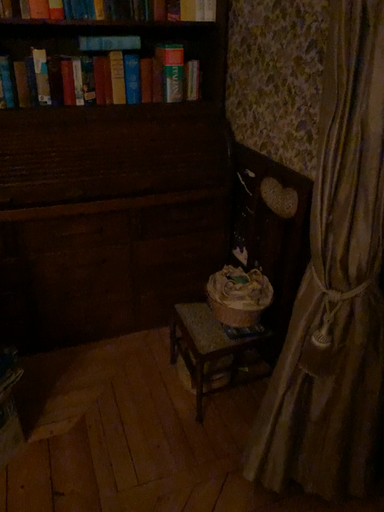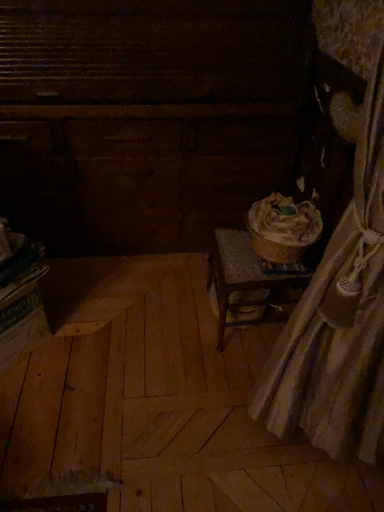
Question: Which way did the camera rotate in the video?

Choices:
 (A) rotated upward
 (B) rotated downward

Answer: (B)